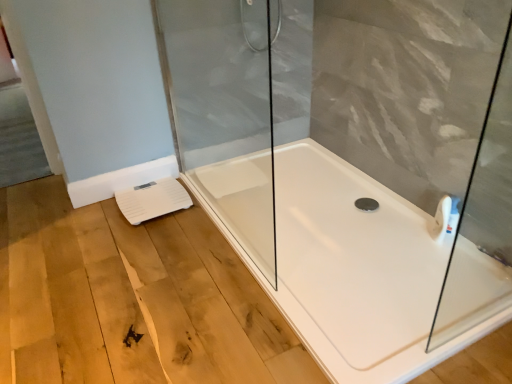
Question: Does transparent glass shower door at center have a greater width compared to white glossy bathtub at center?

Choices:
 (A) yes
 (B) no

Answer: (B)

Question: Could you tell me if transparent glass shower door at center is facing white glossy bathtub at center?

Choices:
 (A) no
 (B) yes

Answer: (A)

Question: Considering the relative positions of transparent glass shower door at center and white glossy bathtub at center in the image provided, is transparent glass shower door at center to the left of white glossy bathtub at center from the viewer's perspective?

Choices:
 (A) no
 (B) yes

Answer: (A)

Question: From a real-world perspective, is transparent glass shower door at center on top of white glossy bathtub at center?

Choices:
 (A) no
 (B) yes

Answer: (B)

Question: Does transparent glass shower door at center come in front of white glossy bathtub at center?

Choices:
 (A) yes
 (B) no

Answer: (B)

Question: Looking at their shapes, would you say white plastic scale at lower left is wider or thinner than white glossy bathtub at center?

Choices:
 (A) wide
 (B) thin

Answer: (B)

Question: Considering the positions of white plastic scale at lower left and white glossy bathtub at center in the image, is white plastic scale at lower left bigger or smaller than white glossy bathtub at center?

Choices:
 (A) small
 (B) big

Answer: (A)

Question: Is point (159, 213) positioned closer to the camera than point (361, 253)?

Choices:
 (A) closer
 (B) farther

Answer: (B)

Question: From the image's perspective, is white plastic scale at lower left located above or below white glossy bathtub at center?

Choices:
 (A) above
 (B) below

Answer: (A)

Question: Is white plastic scale at lower left bigger or smaller than transparent glass shower door at center?

Choices:
 (A) big
 (B) small

Answer: (B)

Question: In terms of width, does white plastic scale at lower left look wider or thinner when compared to transparent glass shower door at center?

Choices:
 (A) wide
 (B) thin

Answer: (A)

Question: From a real-world perspective, is white plastic scale at lower left positioned above or below transparent glass shower door at center?

Choices:
 (A) above
 (B) below

Answer: (B)

Question: In the image, is white plastic scale at lower left positioned in front of or behind transparent glass shower door at center?

Choices:
 (A) front
 (B) behind

Answer: (B)

Question: Considering the relative positions of transparent glass shower door at center and white glossy bathtub at center in the image provided, is transparent glass shower door at center to the left or to the right of white glossy bathtub at center?

Choices:
 (A) left
 (B) right

Answer: (B)

Question: Considering their positions, is transparent glass shower door at center located in front of or behind white glossy bathtub at center?

Choices:
 (A) behind
 (B) front

Answer: (A)